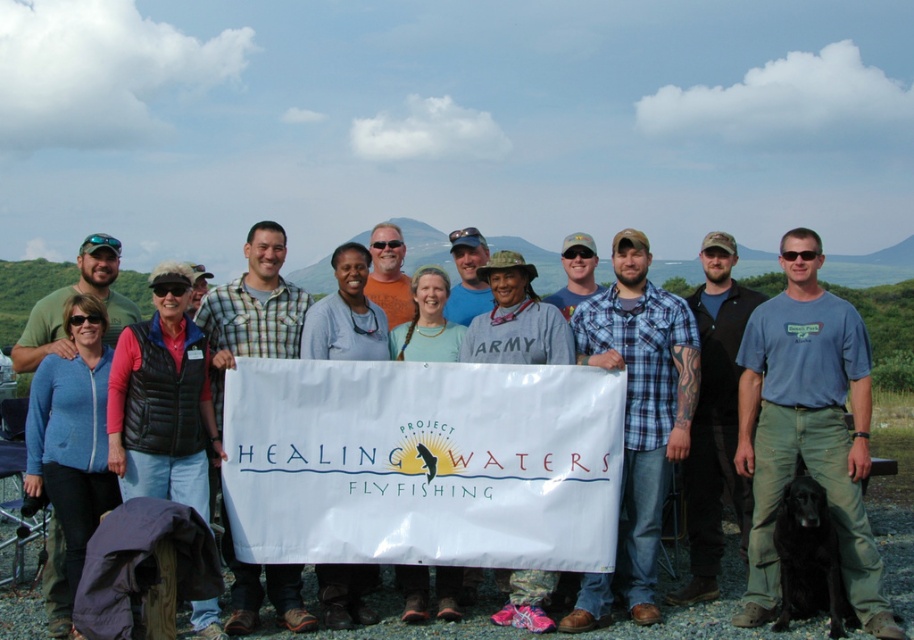
Question: Which object is positioned closest to the blue plaid shirt at center?

Choices:
 (A) matte blue zip-up jacket at center-left
 (B) blue fleece jacket at center

Answer: (A)

Question: Which object is closer to the camera taking this photo?

Choices:
 (A) matte blue zip-up jacket at center-left
 (B) blue fleece jacket at center

Answer: (A)

Question: Can you confirm if blue plaid shirt at center is positioned to the left of blue fleece jacket at center?

Choices:
 (A) no
 (B) yes

Answer: (A)

Question: Estimate the real-world distances between objects in this image. Which object is farther from the matte blue zip-up jacket at center-left?

Choices:
 (A) blue fleece jacket at center
 (B) blue plaid shirt at center

Answer: (B)

Question: Does blue fleece jacket at center appear on the left side of matte blue zip-up jacket at center-left?

Choices:
 (A) yes
 (B) no

Answer: (B)

Question: Is blue fleece jacket at center above matte blue zip-up jacket at center-left?

Choices:
 (A) no
 (B) yes

Answer: (B)